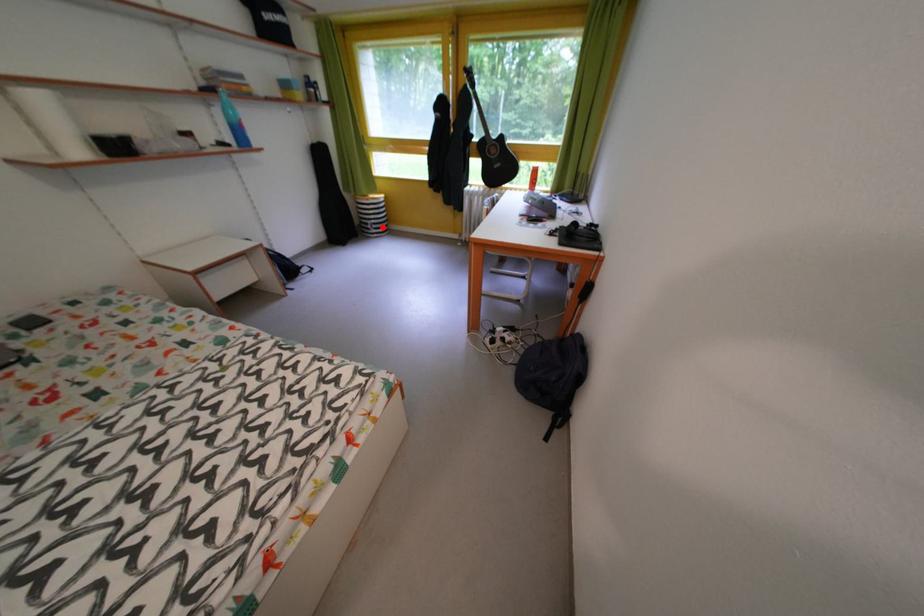
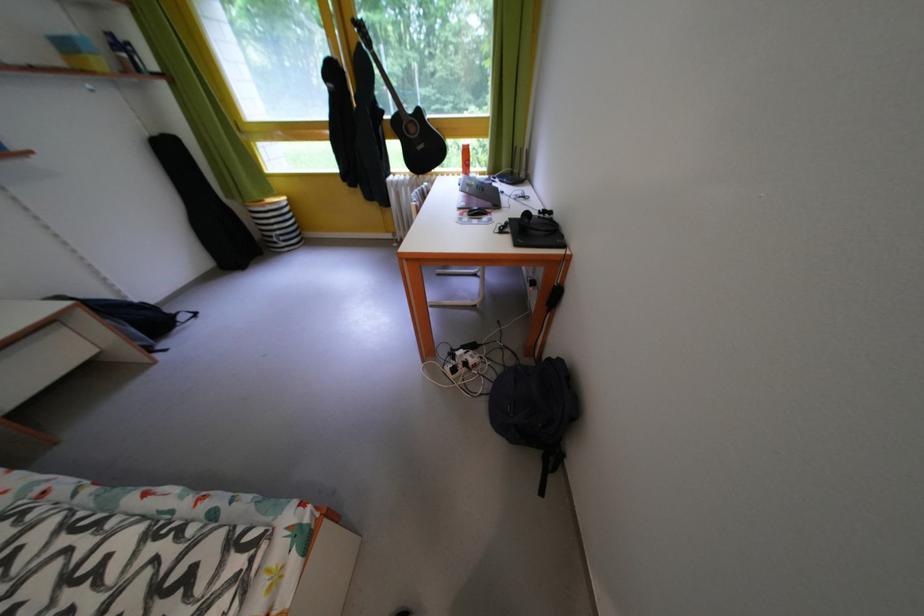
Question: I am providing you with two images of the same scene from different viewpoints. In image1, a red point is highlighted. Considering the same 3D point in image2, which of the following is correct?

Choices:
 (A) It is closer
 (B) It is farther

Answer: (B)